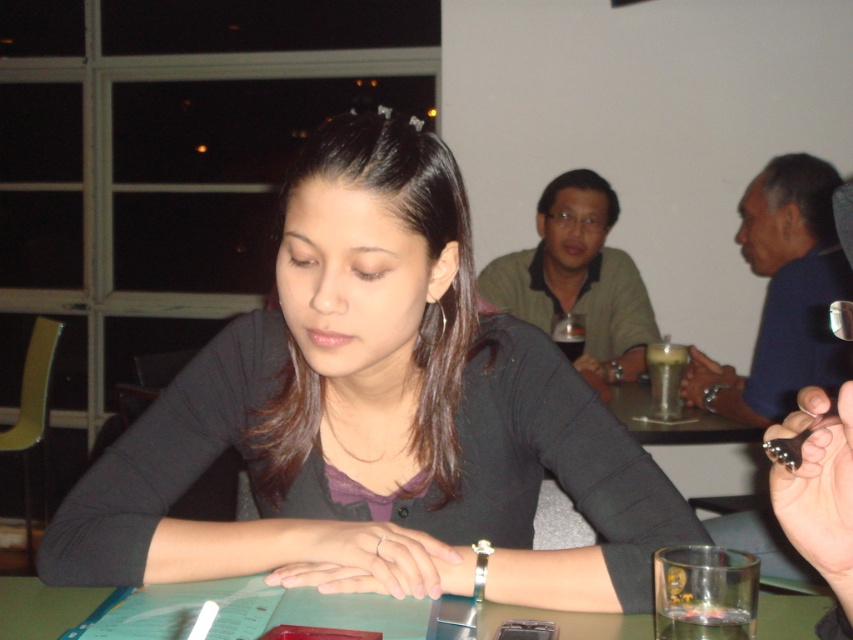
Does matte black shirt at center have a lesser width compared to green matte table at center?

No, matte black shirt at center is not thinner than green matte table at center.

Is matte black shirt at center smaller than green matte table at center?

Actually, matte black shirt at center might be larger than green matte table at center.

Does point (437, 262) lie behind point (640, 634)?

Yes.

At what (x,y) coordinates should I click in order to perform the action: click on matte black shirt at center. Please return your answer as a coordinate pair (x, y). The image size is (853, 640). Looking at the image, I should click on (376, 417).